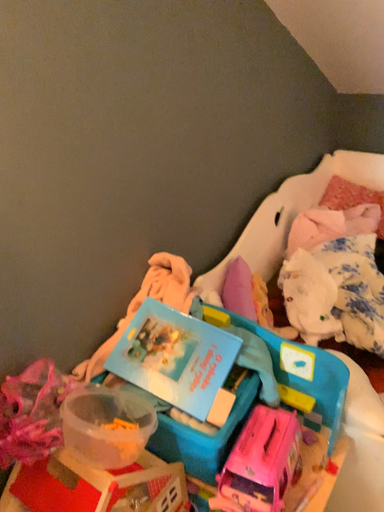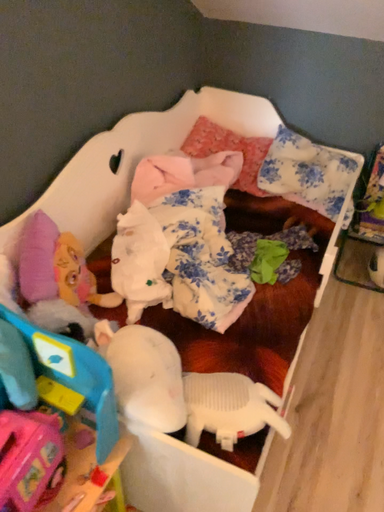
Question: How did the camera likely rotate when shooting the video?

Choices:
 (A) rotated downward
 (B) rotated upward

Answer: (A)